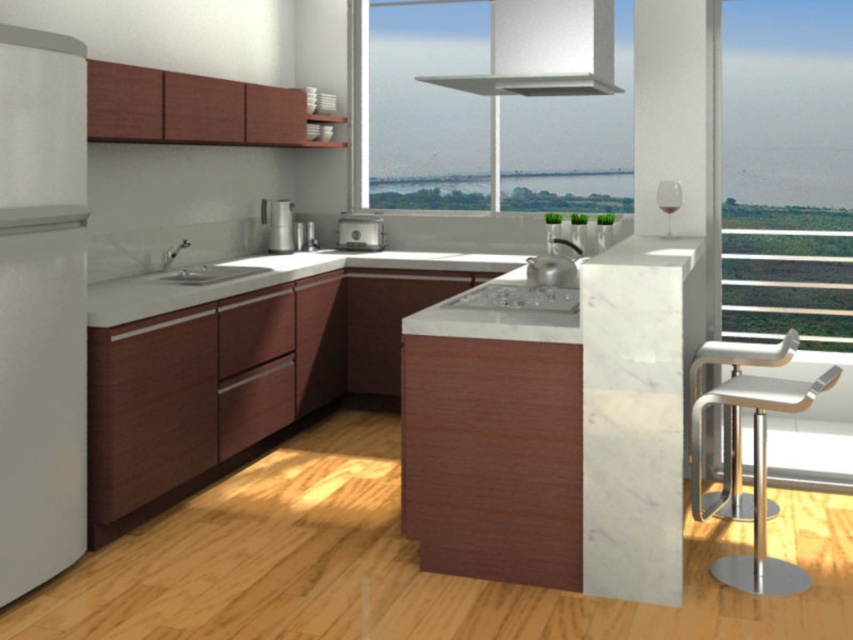
Who is positioned more to the right, white textured exhaust hood at upper center or white glossy sink at center?

white textured exhaust hood at upper center

Does point (610, 24) come farther from viewer compared to point (157, 280)?

No, (610, 24) is closer to viewer.

Is point (468, 80) positioned in front of point (160, 278)?

Yes, point (468, 80) is in front of point (160, 278).

I want to click on white textured exhaust hood at upper center, so (544, 51).

Does white glossy sink at center have a greater width compared to satin silver toaster at center?

Correct, the width of white glossy sink at center exceeds that of satin silver toaster at center.

Which is below, white glossy sink at center or satin silver toaster at center?

white glossy sink at center

Who is more distant from viewer, (202, 280) or (358, 244)?

Positioned behind is point (358, 244).

Locate an element on the screen. white glossy sink at center is located at coordinates coord(199,269).

Does transparent glass window at upper center appear on the left side of metallic silver bar stool at right?

Correct, you'll find transparent glass window at upper center to the left of metallic silver bar stool at right.

Does point (518, 202) come farther from viewer compared to point (694, 384)?

That is True.

Locate an element on the screen. The image size is (853, 640). transparent glass window at upper center is located at coordinates (497, 109).